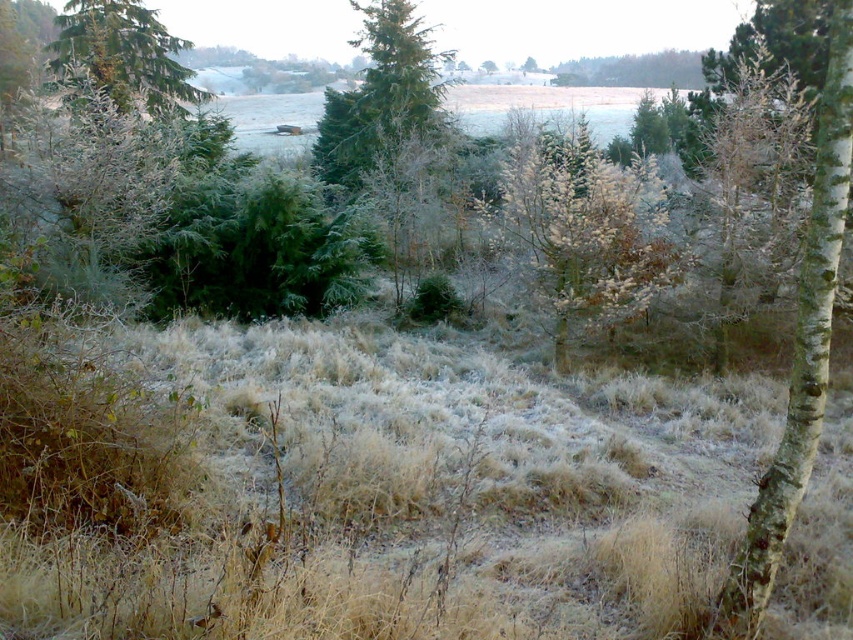
Where is `green matte tree at center`? This screenshot has width=853, height=640. green matte tree at center is located at coordinates point(379,93).

Is green matte tree at center behind green matte tree at upper left?

Yes, it is behind green matte tree at upper left.

Who is more distant from viewer, (343, 188) or (80, 60)?

Positioned behind is point (343, 188).

What are the coordinates of `green matte tree at center` in the screenshot? It's located at (379, 93).

Identify the location of frosted grass at center. (579, 232).

Does point (498, 220) come in front of point (833, 216)?

No, (498, 220) is further to viewer.

Who is more distant from viewer, (584,131) or (805,291)?

Point (584,131)

Identify the location of frosted grass at center. This screenshot has width=853, height=640. (579, 232).

In the scene shown: Does white bark tree at right appear under green matte tree at center?

Yes, white bark tree at right is below green matte tree at center.

Is white bark tree at right in front of green matte tree at center?

Yes.

Measure the distance between white bark tree at right and camera.

The distance of white bark tree at right from camera is 10.10 feet.

You are a GUI agent. You are given a task and a screenshot of the screen. Output one action in this format:
    pyautogui.click(x=<x>, y=<y>)
    Task: Click on the white bark tree at right
    This screenshot has height=640, width=853.
    Given the screenshot: What is the action you would take?
    pyautogui.click(x=799, y=352)